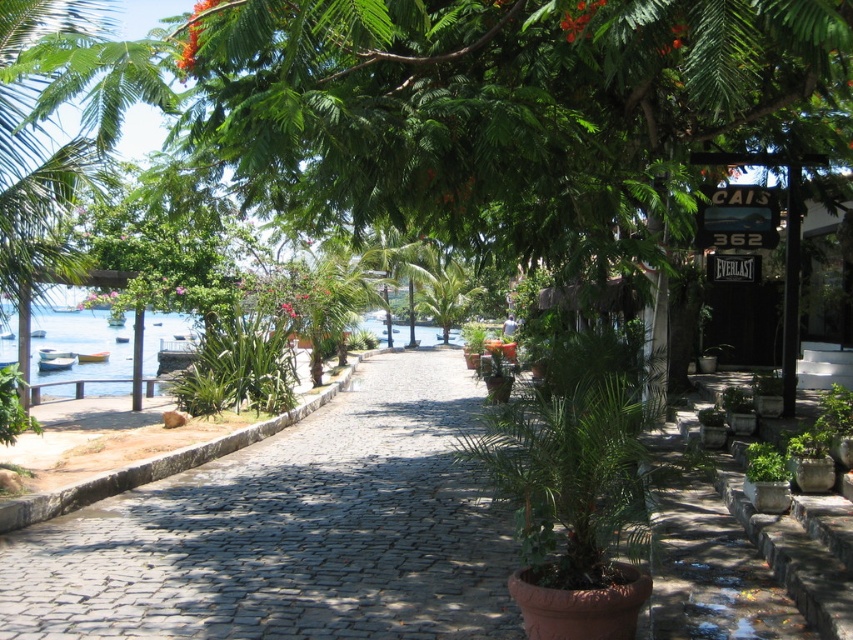
Is green leafy tree at center smaller than cobblestone pavement at center?

Yes.

Between point (769, 70) and point (447, 532), which one is positioned behind?

Point (447, 532)

Does point (427, 33) lie in front of point (32, 592)?

Yes.

In order to click on green leafy tree at center in this screenshot , I will do `click(511, 113)`.